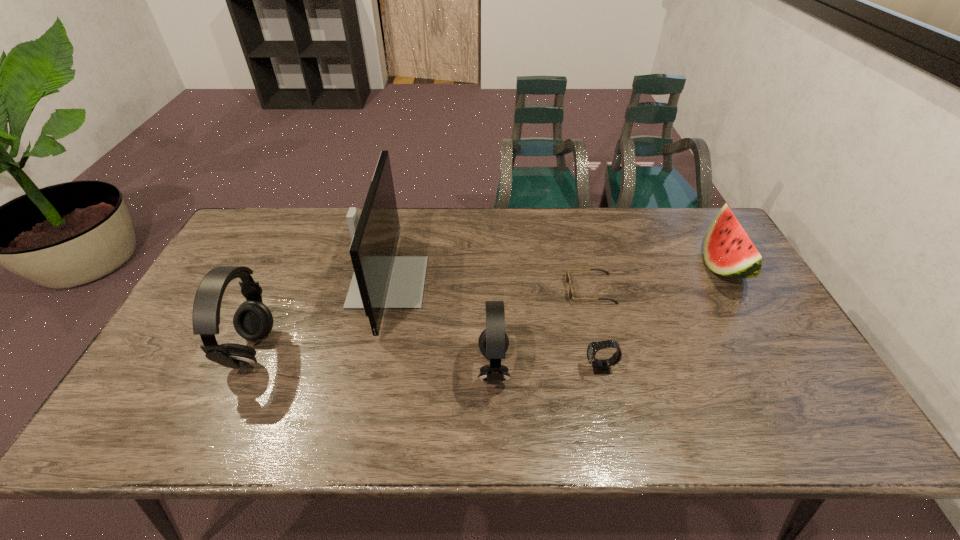
I want to click on the left earphone, so click(x=253, y=320).

Locate an element on the screen. This screenshot has height=540, width=960. the taller earphone is located at coordinates (253, 320).

Identify the location of the right earphone. 493,342.

Identify the location of the shorter earphone. The image size is (960, 540). click(493, 342).

Identify the location of the shortest object. (567, 279).

Image resolution: width=960 pixels, height=540 pixels. Find the location of `computer monitor`. computer monitor is located at coordinates (381, 280).

This screenshot has width=960, height=540. I want to click on the tallest object, so click(381, 280).

Where is `the fourth tallest object`? the fourth tallest object is located at coordinates (728, 251).

Image resolution: width=960 pixels, height=540 pixels. I want to click on watermelon, so click(728, 251).

Identify the location of watch. (599, 366).